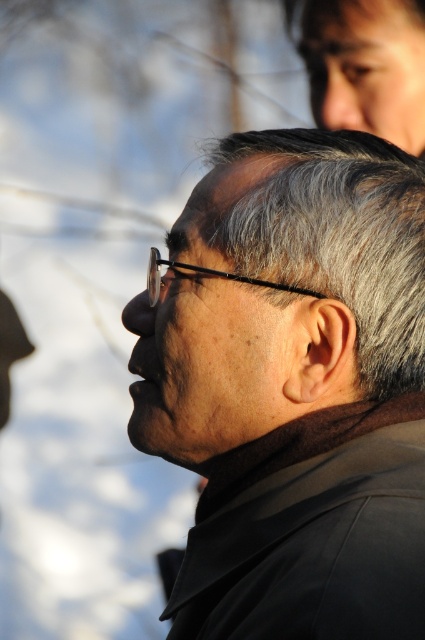
Is matte black jacket at center taller than gray matte hair at center?

Yes, matte black jacket at center is taller than gray matte hair at center.

Who is more forward, [300,264] or [424,252]?

Point [300,264] is more forward.

Identify the location of matte black jacket at center. (289, 385).